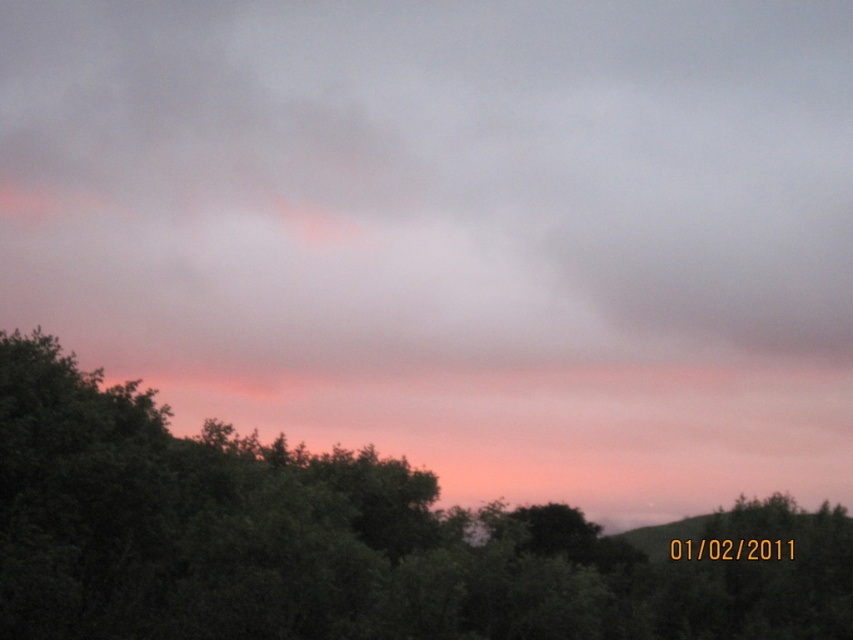
In the serene landscape scene, you see a pink translucent cloud at upper center and a green leafy tree at lower left. From the perspective of an observer looking at the image, which object is positioned to the left of the other?

The pink translucent cloud at upper center is positioned to the left of the green leafy tree at lower left.

You are an artist trying to paint this scene. You want to ensure the pink translucent cloud at upper center and the green leafy tree at lower left are proportionally accurate. Which object should you make wider in your painting?

The pink translucent cloud at upper center should be made wider in the painting since its width is larger than the green leafy tree at lower left according to the description.